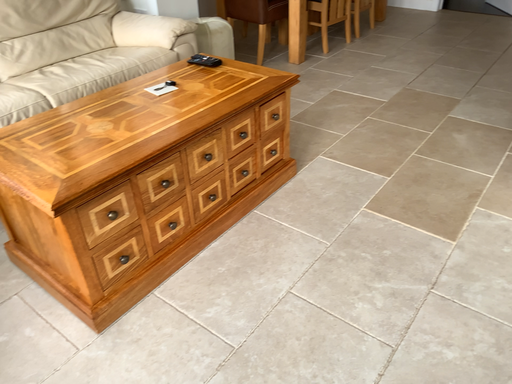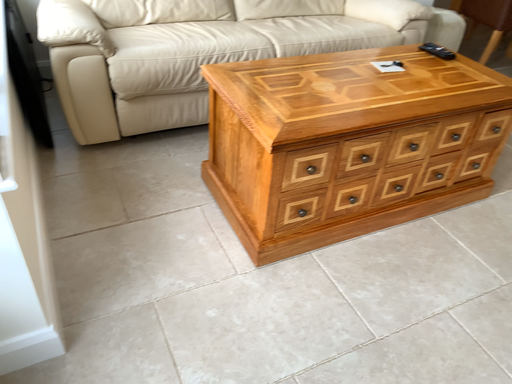
Question: Which way did the camera rotate in the video?

Choices:
 (A) rotated right
 (B) rotated left

Answer: (B)